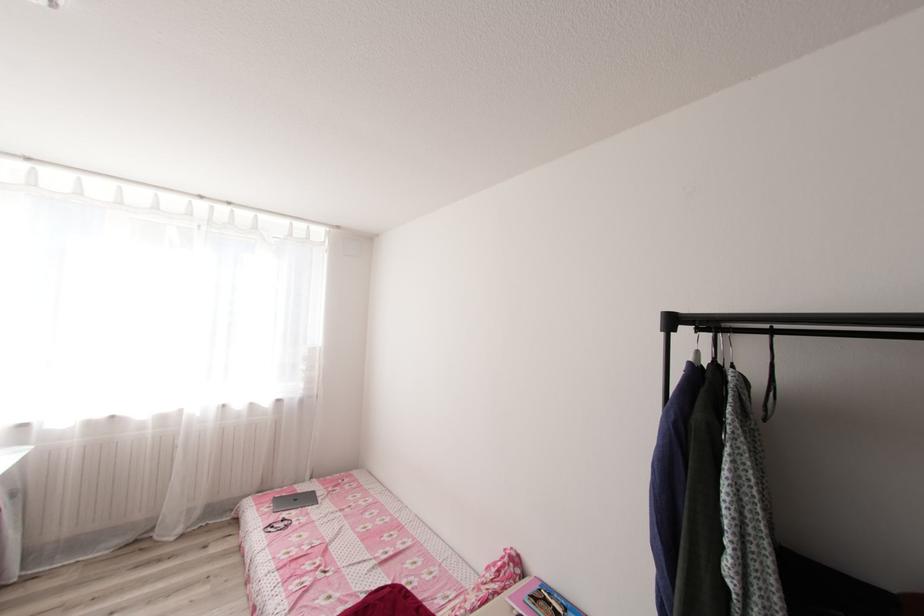
You are a GUI agent. You are given a task and a screenshot of the screen. Output one action in this format:
    pyautogui.click(x=<x>, y=<y>)
    Task: Click on the grey laptop
    The height and width of the screenshot is (616, 924).
    Given the screenshot: What is the action you would take?
    pyautogui.click(x=294, y=500)